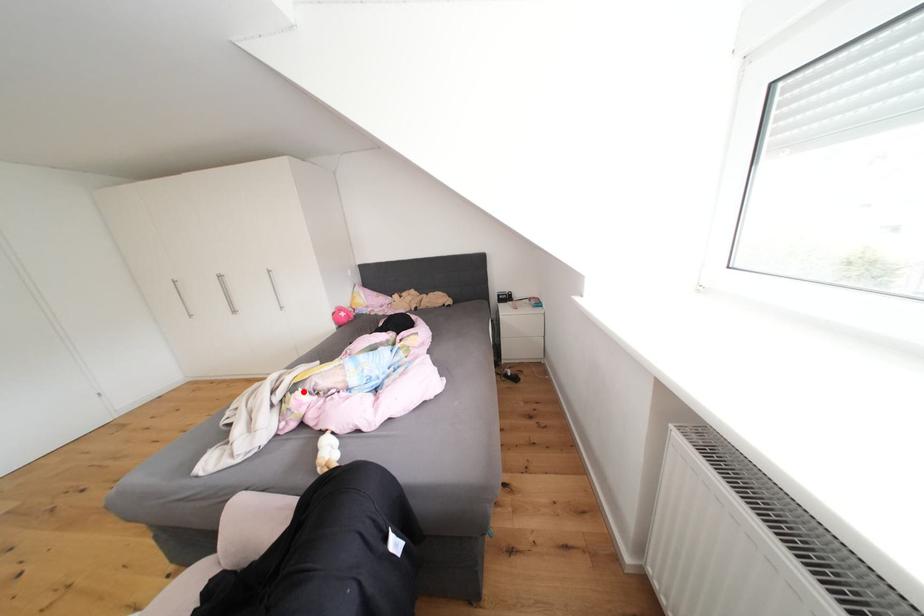
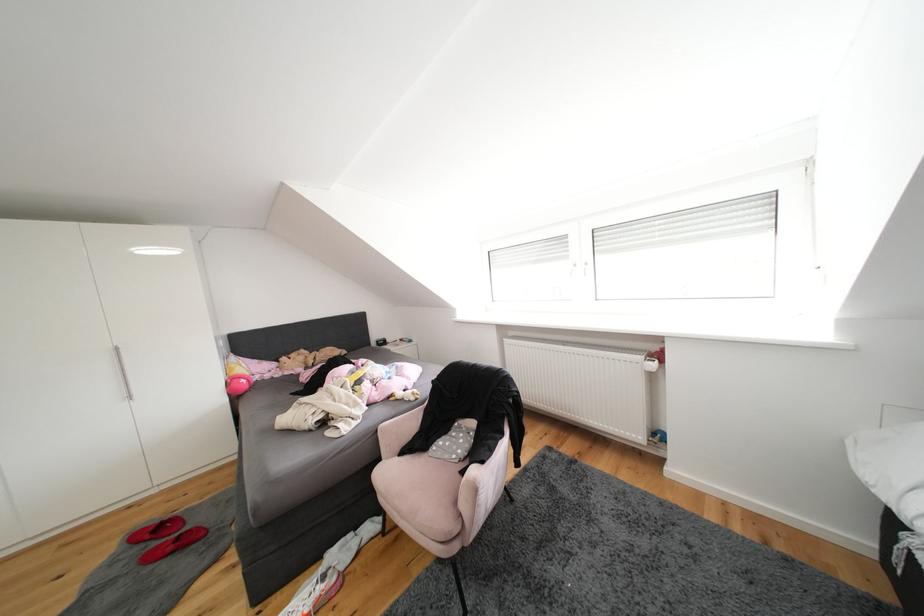
In the second image, find the point that corresponds to the highlighted location in the first image.

(368, 386)